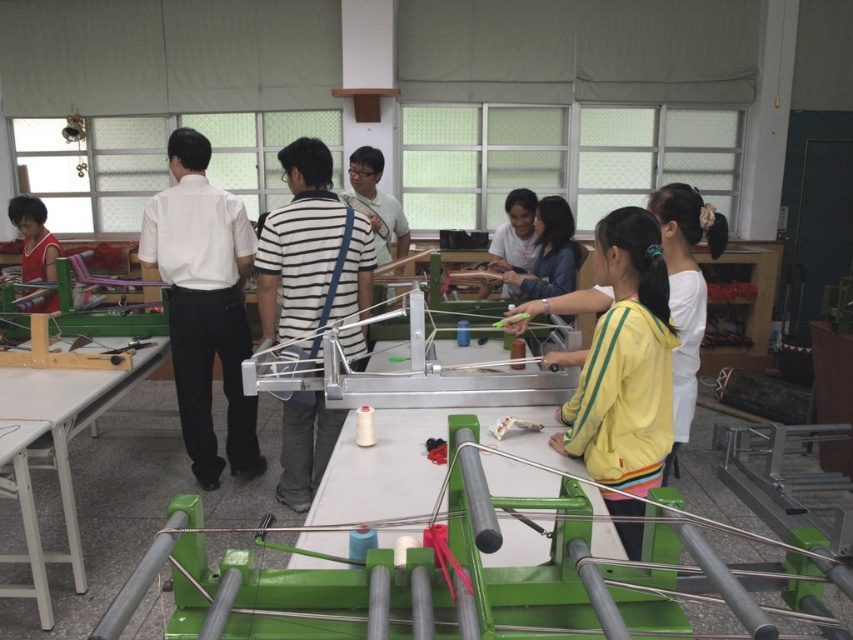
You are a photographer in this workshop and want to take a photo of the white striped shirt at center and the matte red shirt at left. Which shirt should you focus on first if you want to capture both in the frame without moving the camera?

The white striped shirt at center is positioned on the right side of the matte red shirt at left, so you should focus on the matte red shirt at left first since it is closer to the left edge of the frame, allowing both shirts to be captured without moving the camera.

You are organizing a workshop and need to seat participants based on their shirt colors. You have a table that can only accommodate people with shirts wider than 40 cm. Are both the white shirt at center and the matte red shirt at left eligible to sit at this table?

The white shirt at center has a width less than the matte red shirt at left. Since the table requires shirts wider than 40 cm, only the matte red shirt at left may be eligible if its width exceeds 40 cm. The white shirt at center is narrower and thus likely ineligible.

Consider the image. You are a photographer trying to capture a group photo of the white striped shirt at center and the matte red shirt at left. Since you want to ensure both subjects are in focus, you need to know their heights. Which person should you adjust the camera angle for to account for their height?

The white striped shirt at center is much taller than the matte red shirt at left, so you should adjust the camera angle to account for the height difference, focusing first on the taller individual to ensure both are in focus.